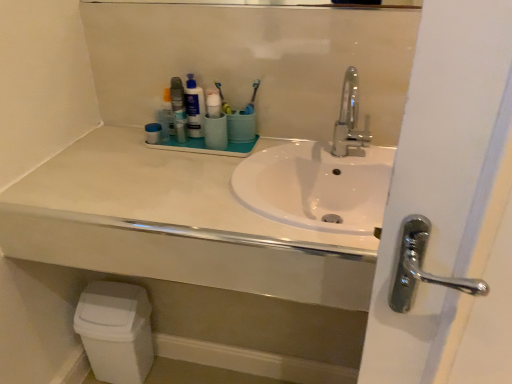
Locate an element on the screen. vacant space positioned to the left of matte plastic container at upper center, which is counted as the 3th toiletry, starting from the right is located at coordinates (103, 144).